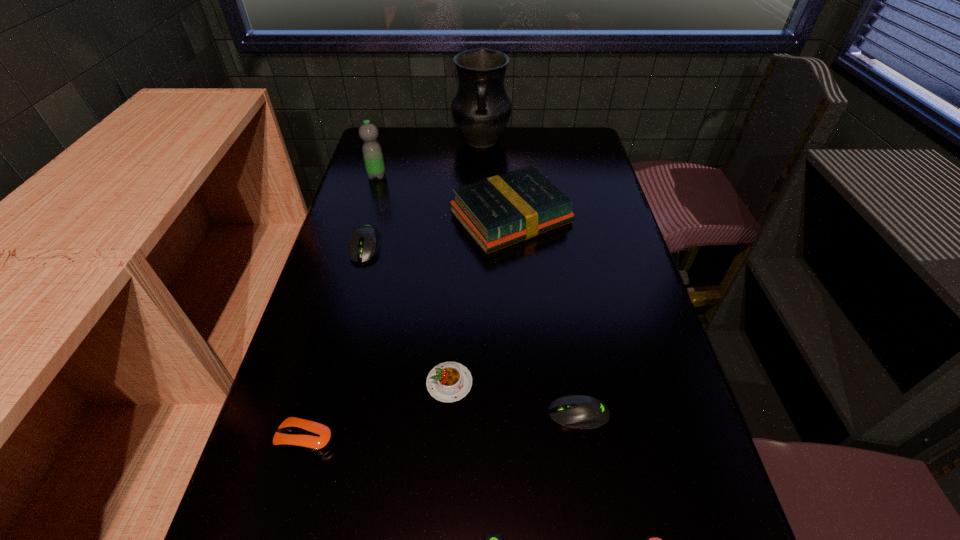
Locate an element on the screen. This screenshot has height=540, width=960. vacant area that lies between the sixth shortest object and the second farthest object is located at coordinates (372, 211).

At what (x,y) coordinates should I click in order to perform the action: click on empty space between the yellow hardback book and the water bottle. Please return your answer as a coordinate pair (x, y). The width and height of the screenshot is (960, 540). Looking at the image, I should click on (444, 197).

Find the location of `empty space that is in between the second smallest gray computer mouse and the yellow hardback book`. empty space that is in between the second smallest gray computer mouse and the yellow hardback book is located at coordinates (544, 315).

I want to click on free area in between the eighth nearest object and the hardback book, so click(444, 197).

Locate which object ranks sixth in proximity to the third computer mouse from right to left. Please provide its 2D coordinates. Your answer should be formatted as a tuple, i.e. [(x, y)], where the tuple contains the x and y coordinates of a point satisfying the conditions above.

[(365, 241)]

Identify which object is the sixth nearest to the pudding. Please provide its 2D coordinates. Your answer should be formatted as a tuple, i.e. [(x, y)], where the tuple contains the x and y coordinates of a point satisfying the conditions above.

[(654, 539)]

Find the location of `computer mouse that is the third closest to the pudding`. computer mouse that is the third closest to the pudding is located at coordinates (493, 539).

The height and width of the screenshot is (540, 960). Identify the location of the third closest computer mouse to the right orange computer mouse. (312, 438).

Identify which gray computer mouse is located as the third nearest to the seventh shortest object. Please provide its 2D coordinates. Your answer should be formatted as a tuple, i.e. [(x, y)], where the tuple contains the x and y coordinates of a point satisfying the conditions above.

[(493, 539)]

Identify the location of gray computer mouse that can be found as the second closest to the hardback book. (575, 411).